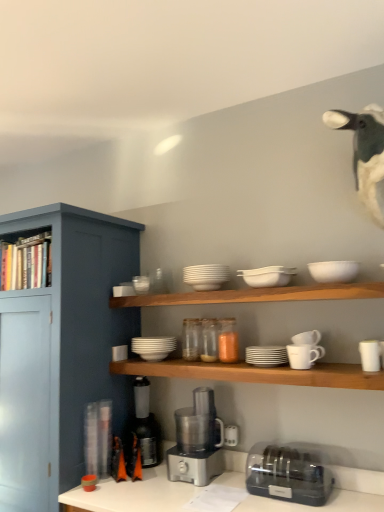
Where is `free region on the left part of white matte plates at center, which is counted as the fifth tableware, starting from the left`? free region on the left part of white matte plates at center, which is counted as the fifth tableware, starting from the left is located at coordinates (230, 367).